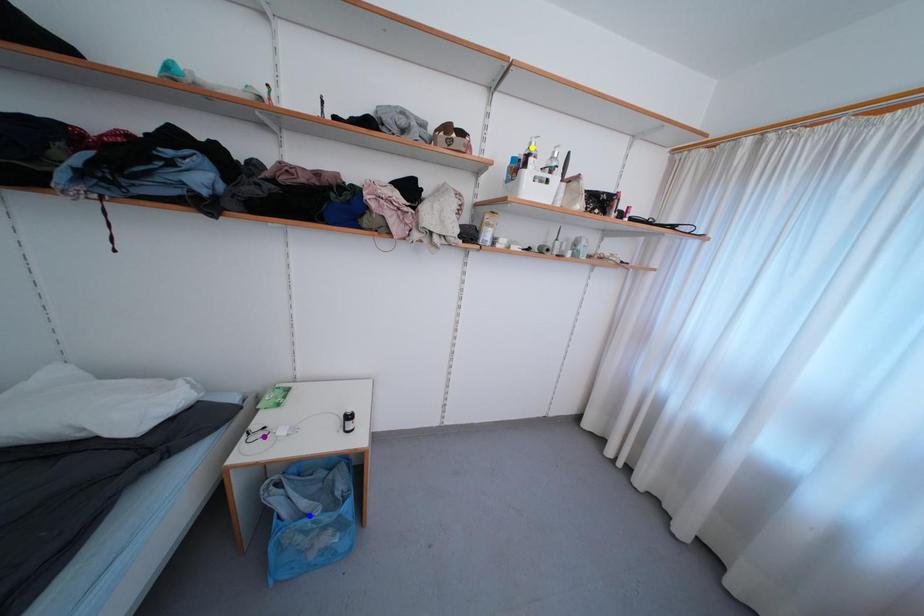
Consider the image. Order these from nearest to farthest:
yellow point
purple point
blue point

1. yellow point
2. purple point
3. blue point